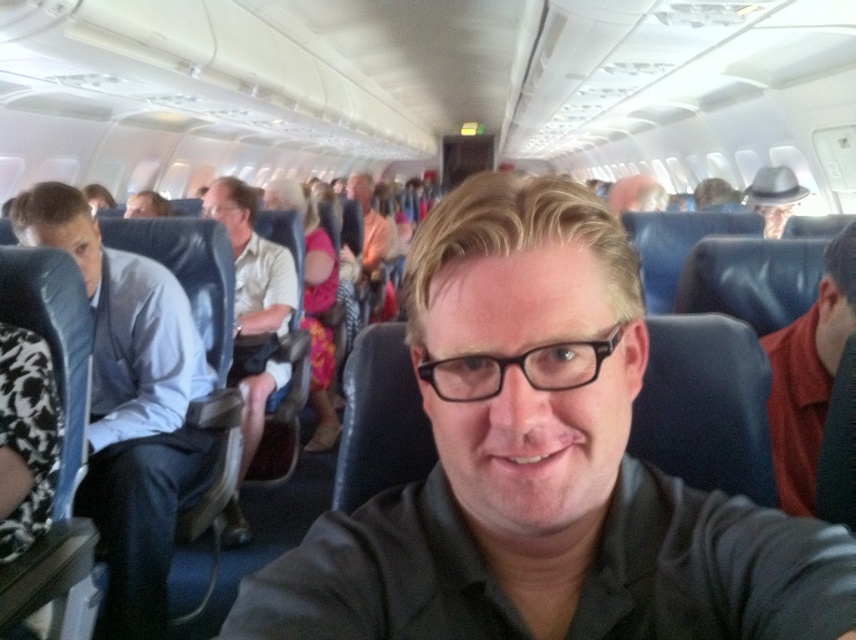
Consider the image. You are a flight attendant checking the height of passengers for safety reasons. You need to know which passenger is shorter between the red shirt at right and the light beige shirt at center. Which one should you measure first?

The red shirt at right is shorter than the light beige shirt at center, so you should measure the red shirt at right first since it is the shorter one.

You are seated in an airplane cabin and notice two passengers in front of you. One is wearing a light blue shirt at left, and the other is wearing a light beige shirt at center. If you want to reach for your bag stored in the overhead compartment, which passenger might block your access more due to their clothing width?

The light blue shirt at left might be wider than the light beige shirt at center, so reaching for your bag might be more obstructed by the passenger in the light blue shirt at left.